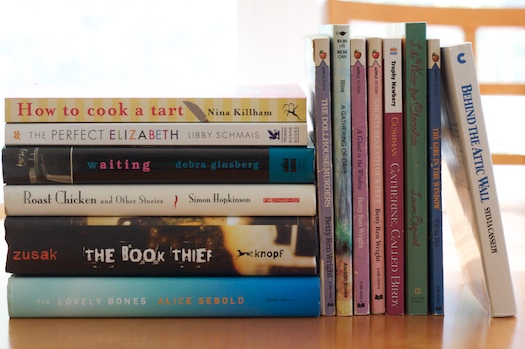
You are a GUI agent. You are given a task and a screenshot of the screen. Output one action in this format:
    pyautogui.click(x=<x>, y=<y>)
    Task: Click on the book standing up
    This screenshot has height=349, width=525.
    Given the screenshot: What is the action you would take?
    pyautogui.click(x=322, y=150), pyautogui.click(x=340, y=152), pyautogui.click(x=359, y=152), pyautogui.click(x=375, y=157), pyautogui.click(x=390, y=158), pyautogui.click(x=412, y=162), pyautogui.click(x=432, y=164), pyautogui.click(x=474, y=153)